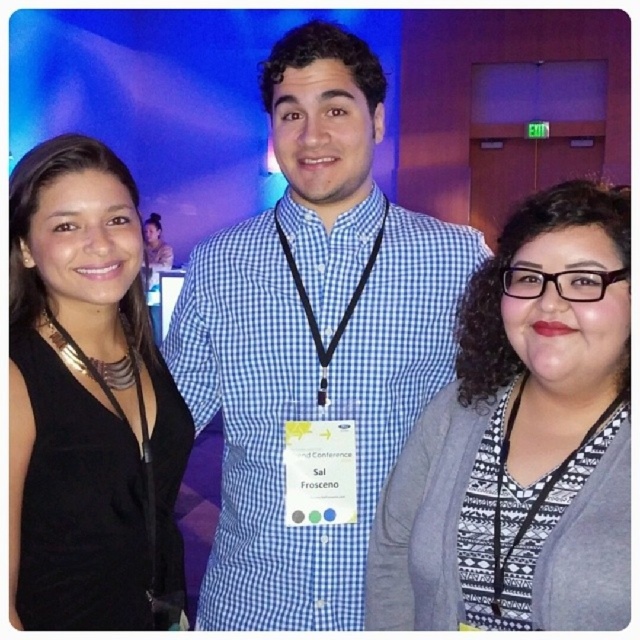
You are a photographer setting up for a group photo. You need to ensure that the blue checkered shirt at center and the black matte dress at left are both fully visible in the frame. Based on their positions and sizes, is there a risk that one might be partially cut off if you focus on the center?

The blue checkered shirt at center might be wider than black matte dress at left, so focusing on the center could risk cutting off the black matte dress at left if it is narrower. Adjust the frame to include both fully.